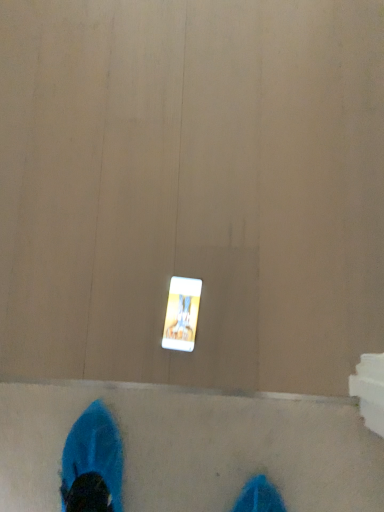
Where is `vacant space in front of white glossy mobile phone at center`? The width and height of the screenshot is (384, 512). vacant space in front of white glossy mobile phone at center is located at coordinates (218, 368).